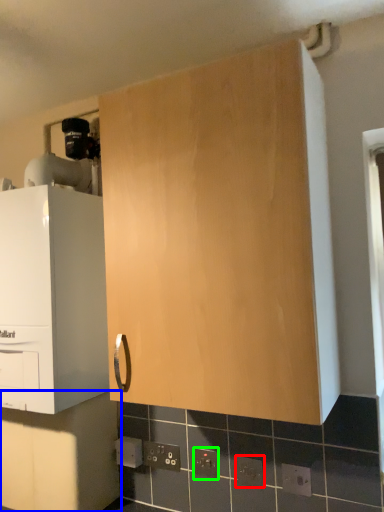
Question: Based on their relative distances, which object is farther from electric outlet (highlighted by a red box)? Choose from cabinetry (highlighted by a blue box) and electric outlet (highlighted by a green box).

Choices:
 (A) cabinetry
 (B) electric outlet

Answer: (A)